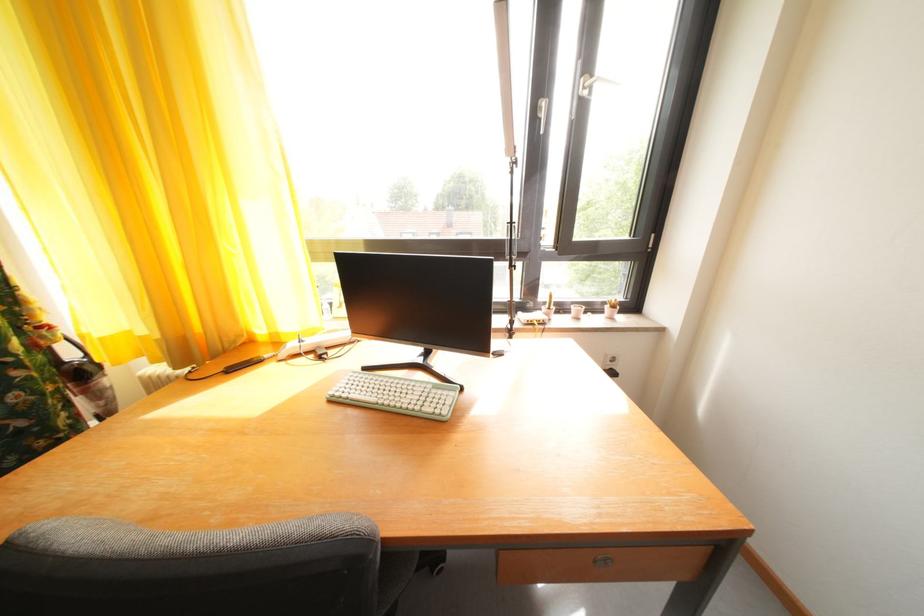
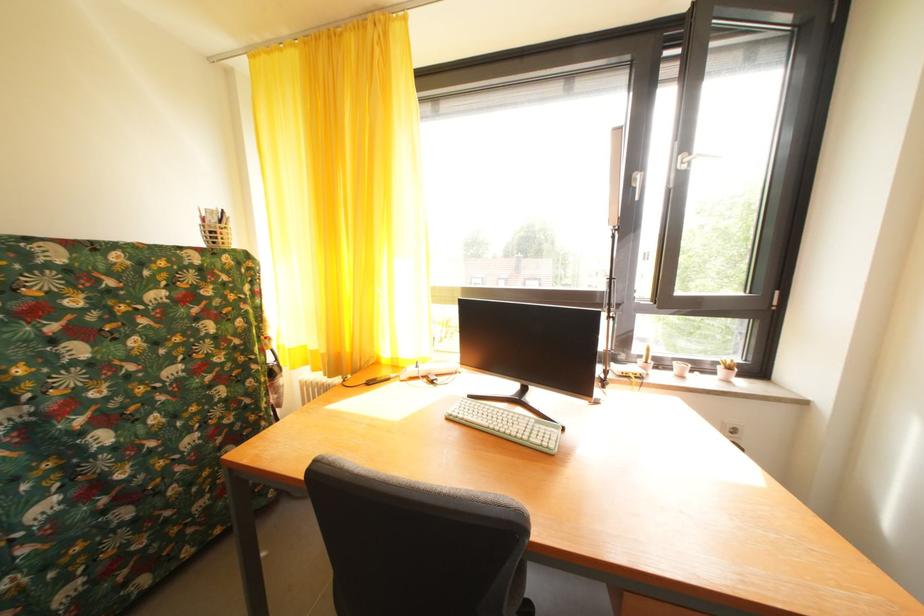
In a continuous first-person perspective shot, in which direction is the camera moving?

The cameraman moved toward left, backward.